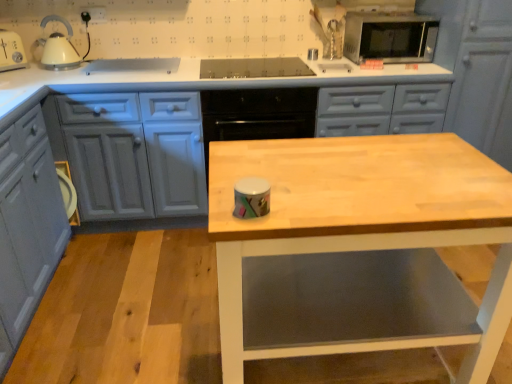
This screenshot has width=512, height=384. Describe the element at coordinates (180, 80) in the screenshot. I see `matte gray cabinets at center, the second cabinetry when ordered from left to right` at that location.

The height and width of the screenshot is (384, 512). What do you see at coordinates (358, 248) in the screenshot? I see `wooden table at center` at bounding box center [358, 248].

This screenshot has width=512, height=384. I want to click on wooden table at center, so click(358, 248).

What do you see at coordinates (27, 226) in the screenshot?
I see `matte gray cabinet at lower left, the 1th cabinetry from the left` at bounding box center [27, 226].

Locate an element on the screen. The image size is (512, 384). matte gray cabinets at center, the second cabinetry when ordered from left to right is located at coordinates (180, 80).

Which is behind, matte gray cabinets at center, the second cabinetry when ordered from left to right, or wooden table at center?

matte gray cabinets at center, the second cabinetry when ordered from left to right, is further away from the camera.

Based on their sizes in the image, would you say matte gray cabinets at center, the second cabinetry when ordered from right to left, is bigger or smaller than wooden table at center?

matte gray cabinets at center, the second cabinetry when ordered from right to left, is bigger than wooden table at center.

Looking at this image, from the image's perspective, would you say matte gray cabinets at center, the second cabinetry when ordered from left to right, is shown under wooden table at center?

Incorrect, from the image's perspective, matte gray cabinets at center, the second cabinetry when ordered from left to right, is higher than wooden table at center.

From a real-world perspective, does wooden table at center stand above matte gray cabinet at lower left, the third cabinetry viewed from the right?

Yes, from a real-world perspective, wooden table at center is on top of matte gray cabinet at lower left, the third cabinetry viewed from the right.

How far apart are wooden table at center and matte gray cabinet at lower left, the third cabinetry viewed from the right?

wooden table at center and matte gray cabinet at lower left, the third cabinetry viewed from the right, are 1.19 meters apart from each other.

Is wooden table at center wider than matte gray cabinet at lower left, the third cabinetry viewed from the right?

Yes, wooden table at center is wider than matte gray cabinet at lower left, the third cabinetry viewed from the right.

There is a wooden table at center. Where is `the 1st cabinetry above it (from the image's perspective)`? the 1st cabinetry above it (from the image's perspective) is located at coordinates (27, 226).

How different are the orientations of matte gray cabinets at center, the second cabinetry when ordered from left to right, and matte gray cabinet at lower left, the 1th cabinetry from the left, in degrees?

They differ by 88.8 degrees in their facing directions.

From the image's perspective, who appears lower, matte gray cabinets at center, the second cabinetry when ordered from right to left, or matte gray cabinet at lower left, the 1th cabinetry from the left?

matte gray cabinet at lower left, the 1th cabinetry from the left.

Is matte gray cabinets at center, the second cabinetry when ordered from right to left, in front of or behind matte gray cabinet at lower left, the third cabinetry viewed from the right, in the image?

In the image, matte gray cabinets at center, the second cabinetry when ordered from right to left, appears behind matte gray cabinet at lower left, the third cabinetry viewed from the right.

From a real-world perspective, who is located lower, matte gray cabinets at center, the second cabinetry when ordered from right to left, or matte gray cabinet at lower left, the third cabinetry viewed from the right?

In real-world perspective, matte gray cabinet at lower left, the third cabinetry viewed from the right, is lower.

Find the location of `cabinetry that is the 2nd one when counting leftward from the wooden table at center`. cabinetry that is the 2nd one when counting leftward from the wooden table at center is located at coordinates (27, 226).

Looking at their sizes, would you say matte gray cabinet at lower left, the third cabinetry viewed from the right, is wider or thinner than wooden table at center?

Considering their sizes, matte gray cabinet at lower left, the third cabinetry viewed from the right, looks slimmer than wooden table at center.

Visually, is matte gray cabinet at lower left, the third cabinetry viewed from the right, positioned to the left or to the right of wooden table at center?

Clearly, matte gray cabinet at lower left, the third cabinetry viewed from the right, is on the left of wooden table at center in the image.

Is point (25, 200) positioned before point (505, 221)?

No, (25, 200) is behind (505, 221).

This screenshot has width=512, height=384. Find the location of `cabinetry that is the 1st one when counting backward from the matte gray cabinet at lower left, the 1th cabinetry from the left`. cabinetry that is the 1st one when counting backward from the matte gray cabinet at lower left, the 1th cabinetry from the left is located at coordinates coord(180,80).

Looking at this image, is matte gray cabinet at lower left, the 1th cabinetry from the left, not near matte gray cabinets at center, the second cabinetry when ordered from right to left?

No.

Is the depth of matte gray cabinet at lower left, the third cabinetry viewed from the right, greater than that of matte gray cabinets at center, the second cabinetry when ordered from left to right?

No, matte gray cabinet at lower left, the third cabinetry viewed from the right, is in front of matte gray cabinets at center, the second cabinetry when ordered from left to right.

Based on their positions, is matte gray cabinet at lower left, the 1th cabinetry from the left, located to the left or right of matte gray cabinets at center, the second cabinetry when ordered from right to left?

matte gray cabinet at lower left, the 1th cabinetry from the left, is to the left of matte gray cabinets at center, the second cabinetry when ordered from right to left.

Is point (501, 31) less distant than point (56, 81)?

That is False.

Could matte gray cabinets at center, the second cabinetry when ordered from right to left, be considered to be inside matte gray cabinet at upper right, which appears as the 3th cabinetry when viewed from the left?

Actually, matte gray cabinets at center, the second cabinetry when ordered from right to left, is outside matte gray cabinet at upper right, which appears as the 3th cabinetry when viewed from the left.

Between matte gray cabinet at upper right, placed as the 1th cabinetry when sorted from right to left, and matte gray cabinets at center, the second cabinetry when ordered from left to right, which one has more height?

matte gray cabinet at upper right, placed as the 1th cabinetry when sorted from right to left, is taller.

Is there a large distance between matte gray cabinet at upper right, which appears as the 3th cabinetry when viewed from the left, and matte gray cabinets at center, the second cabinetry when ordered from left to right?

Actually, matte gray cabinet at upper right, which appears as the 3th cabinetry when viewed from the left, and matte gray cabinets at center, the second cabinetry when ordered from left to right, are a little close together.

Are wooden table at center and matte gray cabinet at upper right, placed as the 1th cabinetry when sorted from right to left, located far from each other?

Yes, wooden table at center and matte gray cabinet at upper right, placed as the 1th cabinetry when sorted from right to left, are quite far apart.

Locate an element on the screen. This screenshot has width=512, height=384. table that appears on the left of matte gray cabinet at upper right, which appears as the 3th cabinetry when viewed from the left is located at coordinates (358, 248).

Consider the image. Is wooden table at center surrounding matte gray cabinet at upper right, which appears as the 3th cabinetry when viewed from the left?

Definitely not — matte gray cabinet at upper right, which appears as the 3th cabinetry when viewed from the left, is not inside wooden table at center.

From the picture: From the image's perspective, which one is positioned lower, wooden table at center or matte gray cabinet at upper right, placed as the 1th cabinetry when sorted from right to left?

wooden table at center appears lower in the image.

From a real-world perspective, which cabinetry is the 1st one underneath the wooden table at center? Please provide its 2D coordinates.

[(180, 80)]

The width and height of the screenshot is (512, 384). In order to click on table lying on the right of matte gray cabinet at lower left, the 1th cabinetry from the left in this screenshot , I will do `click(358, 248)`.

From the image, which object appears to be nearer to wooden table at center, matte gray cabinets at center, the second cabinetry when ordered from left to right, or matte gray cabinet at lower left, the 1th cabinetry from the left?

matte gray cabinets at center, the second cabinetry when ordered from left to right.

From the image, which object appears to be farther from wooden table at center, matte gray cabinet at lower left, the third cabinetry viewed from the right, or matte gray cabinets at center, the second cabinetry when ordered from right to left?

Based on the image, matte gray cabinet at lower left, the third cabinetry viewed from the right, appears to be further to wooden table at center.

Considering their positions, is matte gray cabinet at lower left, the 1th cabinetry from the left, positioned further to matte gray cabinet at upper right, which appears as the 3th cabinetry when viewed from the left, than matte gray cabinets at center, the second cabinetry when ordered from right to left?

matte gray cabinet at lower left, the 1th cabinetry from the left, is further to matte gray cabinet at upper right, which appears as the 3th cabinetry when viewed from the left.

When comparing their distances from matte gray cabinets at center, the second cabinetry when ordered from right to left, does matte gray cabinet at lower left, the 1th cabinetry from the left, or wooden table at center seem further?

Based on the image, wooden table at center appears to be further to matte gray cabinets at center, the second cabinetry when ordered from right to left.

From the image, which object appears to be nearer to wooden table at center, matte gray cabinets at center, the second cabinetry when ordered from left to right, or matte gray cabinet at upper right, which appears as the 3th cabinetry when viewed from the left?

The object closer to wooden table at center is matte gray cabinets at center, the second cabinetry when ordered from left to right.

Based on their spatial positions, is matte gray cabinet at upper right, placed as the 1th cabinetry when sorted from right to left, or wooden table at center closer to matte gray cabinets at center, the second cabinetry when ordered from left to right?

matte gray cabinet at upper right, placed as the 1th cabinetry when sorted from right to left, lies closer to matte gray cabinets at center, the second cabinetry when ordered from left to right, than the other object.

Looking at the image, which one is located further to matte gray cabinets at center, the second cabinetry when ordered from left to right, matte gray cabinet at upper right, placed as the 1th cabinetry when sorted from right to left, or matte gray cabinet at lower left, the third cabinetry viewed from the right?

Among the two, matte gray cabinet at upper right, placed as the 1th cabinetry when sorted from right to left, is located further to matte gray cabinets at center, the second cabinetry when ordered from left to right.

In the scene shown: Looking at the image, which one is located closer to matte gray cabinet at lower left, the 1th cabinetry from the left, wooden table at center or matte gray cabinet at upper right, which appears as the 3th cabinetry when viewed from the left?

wooden table at center lies closer to matte gray cabinet at lower left, the 1th cabinetry from the left, than the other object.

Locate an element on the screen. table located between matte gray cabinet at lower left, the 1th cabinetry from the left, and matte gray cabinet at upper right, placed as the 1th cabinetry when sorted from right to left, in the left-right direction is located at coordinates (358, 248).

At what (x,y) coordinates should I click in order to perform the action: click on table between matte gray cabinets at center, the second cabinetry when ordered from left to right, and matte gray cabinet at upper right, which appears as the 3th cabinetry when viewed from the left. Please return your answer as a coordinate pair (x, y). The width and height of the screenshot is (512, 384). Looking at the image, I should click on (358, 248).

The image size is (512, 384). Identify the location of cabinetry located between matte gray cabinet at lower left, the third cabinetry viewed from the right, and matte gray cabinet at upper right, placed as the 1th cabinetry when sorted from right to left, in the left-right direction. (180, 80).

Where is `cabinetry situated between matte gray cabinet at lower left, the third cabinetry viewed from the right, and wooden table at center from left to right`? This screenshot has width=512, height=384. cabinetry situated between matte gray cabinet at lower left, the third cabinetry viewed from the right, and wooden table at center from left to right is located at coordinates (180, 80).